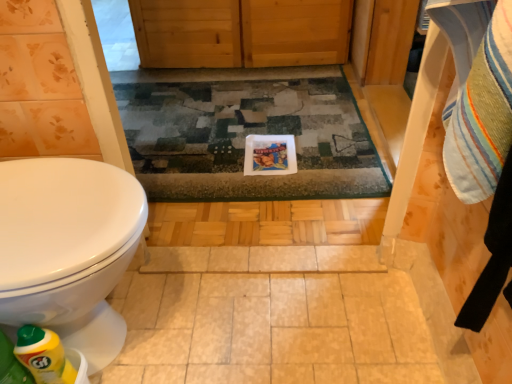
Where is `yellow plastic bottle at lower left`? Image resolution: width=512 pixels, height=384 pixels. yellow plastic bottle at lower left is located at coordinates (44, 356).

What do you see at coordinates (44, 356) in the screenshot?
I see `yellow plastic bottle at lower left` at bounding box center [44, 356].

Image resolution: width=512 pixels, height=384 pixels. What are the coordinates of `multicolored woven rug at center` in the screenshot? It's located at (245, 135).

What do you see at coordinates (245, 135) in the screenshot? I see `multicolored woven rug at center` at bounding box center [245, 135].

Measure the distance between point (156, 160) and camera.

5.75 feet.

In order to click on yellow plastic bottle at lower left in this screenshot , I will do `click(44, 356)`.

Considering the relative positions of yellow plastic bottle at lower left and multicolored woven rug at center in the image provided, is yellow plastic bottle at lower left to the right of multicolored woven rug at center from the viewer's perspective?

No, yellow plastic bottle at lower left is not to the right of multicolored woven rug at center.

Which object is closer to the camera taking this photo, yellow plastic bottle at lower left or multicolored woven rug at center?

Positioned in front is yellow plastic bottle at lower left.

Which point is more distant from viewer, (32, 327) or (248, 128)?

The point (248, 128) is more distant.

Consider the image. From the image's perspective, relative to multicolored woven rug at center, is yellow plastic bottle at lower left above or below?

yellow plastic bottle at lower left is situated lower than multicolored woven rug at center in the image.

From a real-world perspective, between yellow plastic bottle at lower left and multicolored woven rug at center, who is vertically lower?

multicolored woven rug at center is physically lower.

Considering the relative sizes of yellow plastic bottle at lower left and multicolored woven rug at center in the image provided, is yellow plastic bottle at lower left wider than multicolored woven rug at center?

In fact, yellow plastic bottle at lower left might be narrower than multicolored woven rug at center.

Who is shorter, yellow plastic bottle at lower left or multicolored woven rug at center?

multicolored woven rug at center.

Can you confirm if yellow plastic bottle at lower left is bigger than multicolored woven rug at center?

Actually, yellow plastic bottle at lower left might be smaller than multicolored woven rug at center.

Is multicolored woven rug at center a part of yellow plastic bottle at lower left?

No, multicolored woven rug at center is not a part of yellow plastic bottle at lower left.

Consider the image. Is yellow plastic bottle at lower left in contact with multicolored woven rug at center?

No, yellow plastic bottle at lower left is not with multicolored woven rug at center.

Is yellow plastic bottle at lower left looking in the opposite direction of multicolored woven rug at center?

yellow plastic bottle at lower left is not turned away from multicolored woven rug at center.

What's the angular difference between yellow plastic bottle at lower left and multicolored woven rug at center's facing directions?

The angular difference between yellow plastic bottle at lower left and multicolored woven rug at center is 87.8 degrees.

Where is `bath mat on the right of the yellow plastic bottle at lower left`? This screenshot has height=384, width=512. bath mat on the right of the yellow plastic bottle at lower left is located at coordinates (245, 135).

Is multicolored woven rug at center to the left or to the right of yellow plastic bottle at lower left in the image?

Clearly, multicolored woven rug at center is on the right of yellow plastic bottle at lower left in the image.

Relative to yellow plastic bottle at lower left, is multicolored woven rug at center in front or behind?

In the image, multicolored woven rug at center appears behind yellow plastic bottle at lower left.

Between point (220, 123) and point (49, 338), which one is positioned in front?

Positioned in front is point (49, 338).

From the image's perspective, relative to yellow plastic bottle at lower left, is multicolored woven rug at center above or below?

multicolored woven rug at center is situated higher than yellow plastic bottle at lower left in the image.

From a real-world perspective, which is physically below, multicolored woven rug at center or yellow plastic bottle at lower left?

multicolored woven rug at center is physically lower.

Is multicolored woven rug at center thinner than yellow plastic bottle at lower left?

No.

Who is shorter, multicolored woven rug at center or yellow plastic bottle at lower left?

multicolored woven rug at center is shorter.

Can you confirm if multicolored woven rug at center is bigger than yellow plastic bottle at lower left?

Yes, multicolored woven rug at center is bigger than yellow plastic bottle at lower left.

Consider the image. Would you say multicolored woven rug at center contains yellow plastic bottle at lower left?

No, yellow plastic bottle at lower left is not inside multicolored woven rug at center.

Can you see multicolored woven rug at center touching yellow plastic bottle at lower left?

No, multicolored woven rug at center is not next to yellow plastic bottle at lower left.

Is multicolored woven rug at center positioned with its back to yellow plastic bottle at lower left?

No, yellow plastic bottle at lower left is not at the back of multicolored woven rug at center.

Where is `cleaning product in front of the multicolored woven rug at center`? cleaning product in front of the multicolored woven rug at center is located at coordinates (44, 356).

Where is `cleaning product that appears in front of the multicolored woven rug at center`? cleaning product that appears in front of the multicolored woven rug at center is located at coordinates (44, 356).

The width and height of the screenshot is (512, 384). I want to click on bath mat below the yellow plastic bottle at lower left (from a real-world perspective), so click(245, 135).